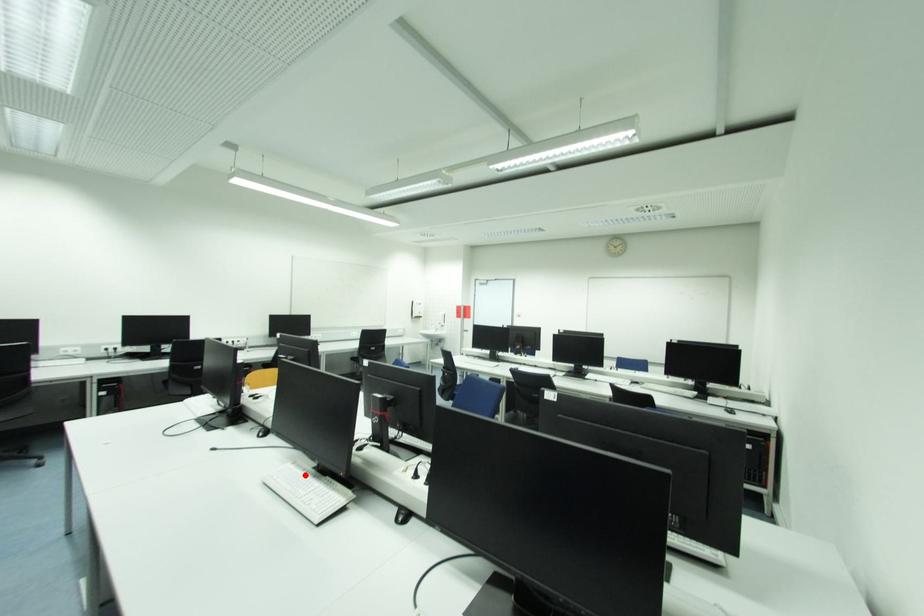
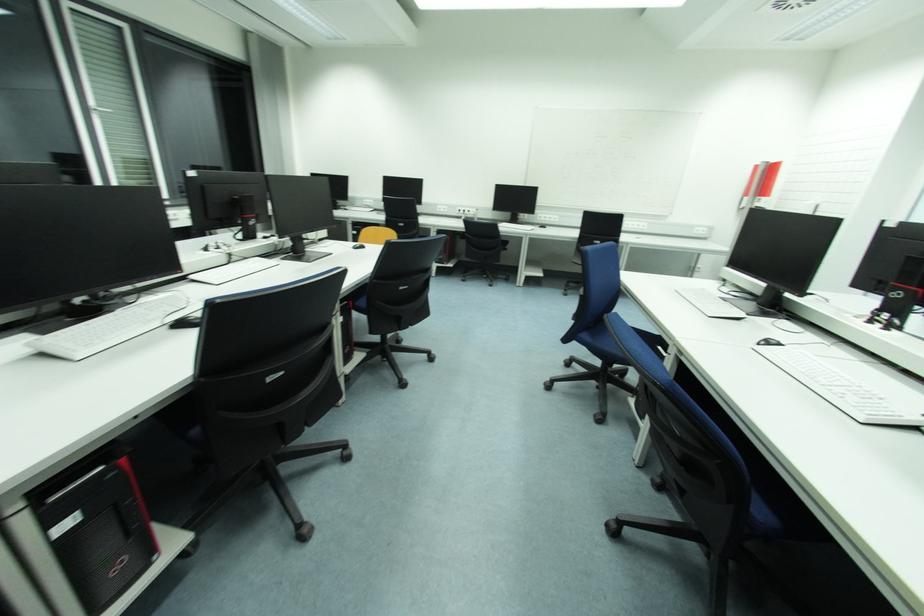
Question: I am providing you with two images of the same scene from different viewpoints. A red point is marked on the first image. Can you still see the location of the red point in image 2?

Choices:
 (A) Yes
 (B) No

Answer: (B)